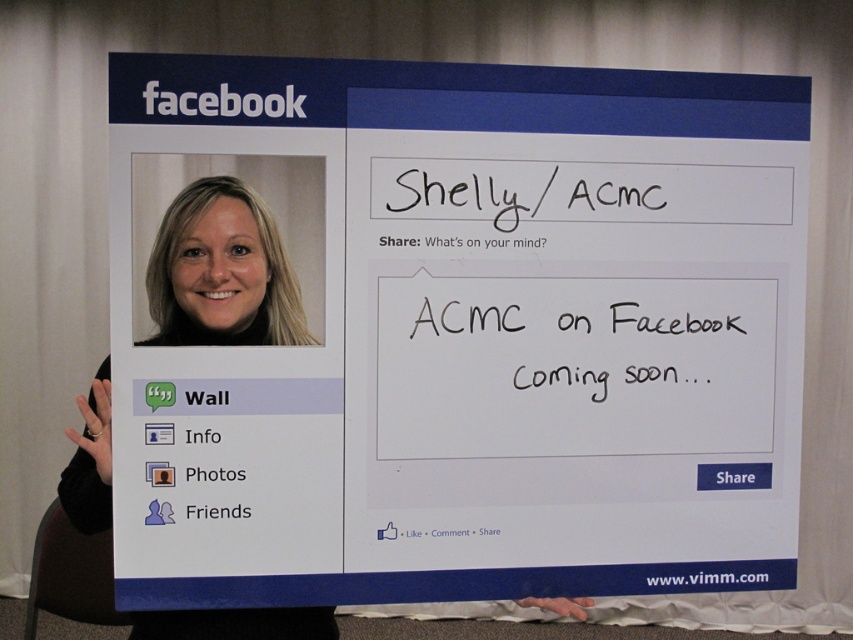
You are standing in front of a large display board. You notice the white paperboard at center and the blonde hair at left. Which object is nearer to you?

The white paperboard at center is closer to the viewer than the blonde hair at left.

Where is the white paperboard at center located?

The white paperboard at center is located at point (469, 336).